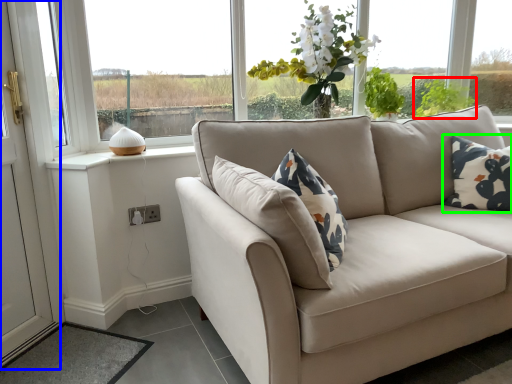
Question: Which object is the farthest from plant (highlighted by a red box)? Choose among these: screen door (highlighted by a blue box) or pillow (highlighted by a green box).

Choices:
 (A) screen door
 (B) pillow

Answer: (A)